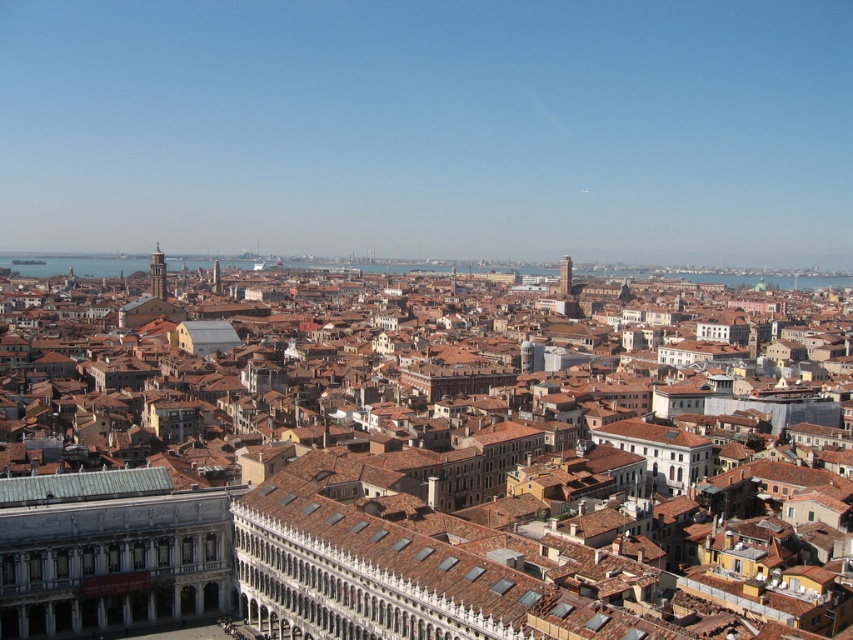
Does brown tile roof at center appear under golden stone tower at upper left?

Indeed, brown tile roof at center is positioned under golden stone tower at upper left.

Does point (564, 452) come closer to viewer compared to point (219, 273)?

That is True.

Is point (103, 454) closer to viewer compared to point (213, 289)?

Yes, point (103, 454) is closer to viewer.

Locate an element on the screen. The image size is (853, 640). brown tile roof at center is located at coordinates (386, 484).

Which is in front, point (155, 257) or point (566, 284)?

Point (155, 257)

Is light brown stone tower at center taller than smooth stone tower at center?

Correct, light brown stone tower at center is much taller as smooth stone tower at center.

Between point (160, 282) and point (564, 264), which one is positioned in front?

Point (160, 282) is more forward.

Where is `light brown stone tower at center`? The image size is (853, 640). light brown stone tower at center is located at coordinates (157, 275).

Who is more forward, (558, 285) or (212, 278)?

Point (212, 278)

Between smooth stone tower at center and golden stone tower at upper left, which one is positioned lower?

Positioned lower is smooth stone tower at center.

Does point (563, 257) come farther from viewer compared to point (218, 273)?

Yes, it is.

Where is `smooth stone tower at center`? The height and width of the screenshot is (640, 853). smooth stone tower at center is located at coordinates (566, 275).